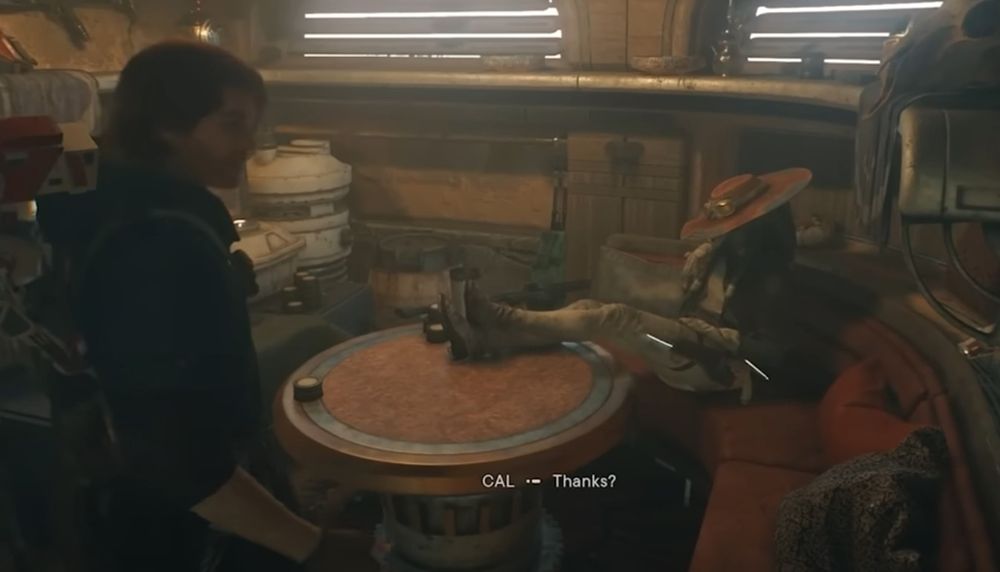
In order to click on table in this screenshot , I will do `click(458, 403)`.